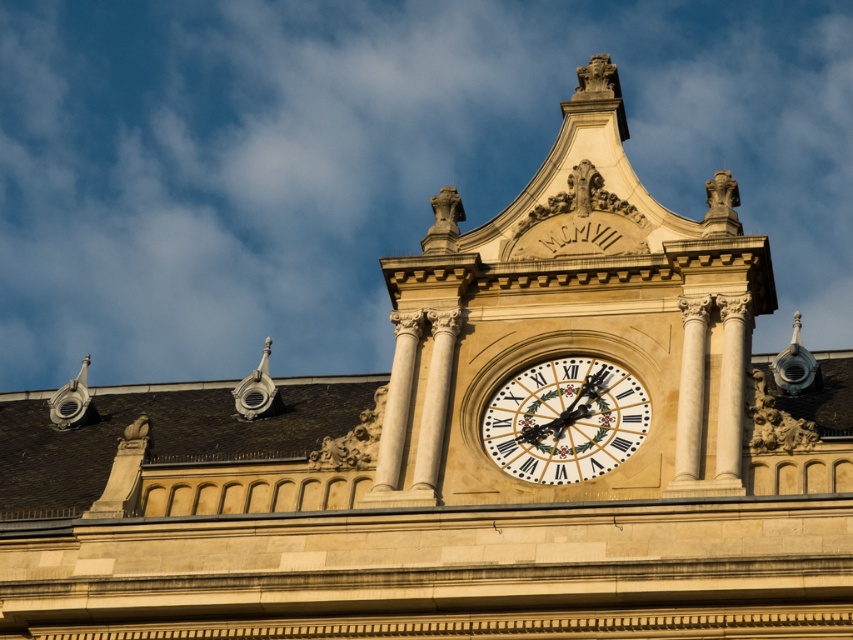
Between beige stone clock at center and gold textured clock at center, which one has more height?

With more height is beige stone clock at center.

Measure the distance between beige stone clock at center and gold textured clock at center.

beige stone clock at center is 1.21 meters from gold textured clock at center.

Which is behind, point (436, 305) or point (554, 460)?

Positioned behind is point (436, 305).

Where is `beige stone clock at center`? The width and height of the screenshot is (853, 640). beige stone clock at center is located at coordinates (x=572, y=333).